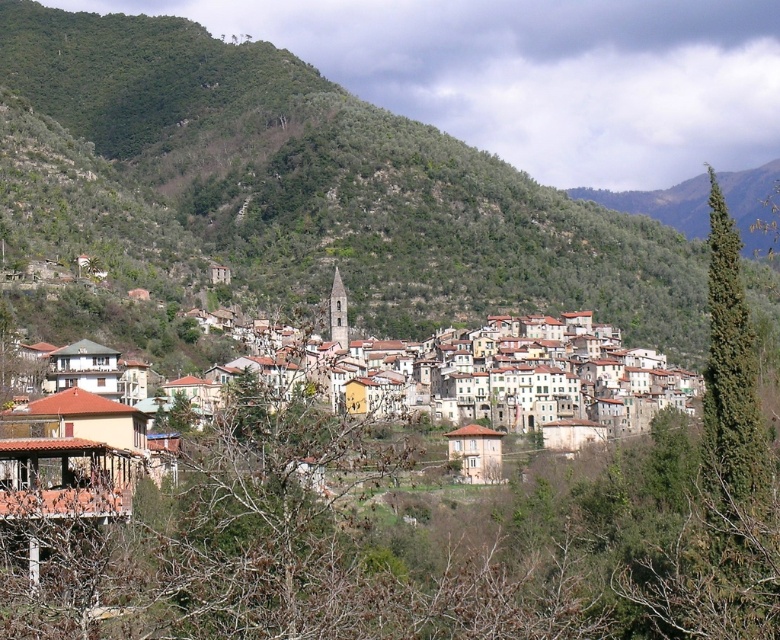
Question: Which point appears farthest from the camera in this image?

Choices:
 (A) (332, 157)
 (B) (743, 412)

Answer: (A)

Question: Is green leafy hillside at center smaller than green coniferous tree at right?

Choices:
 (A) yes
 (B) no

Answer: (B)

Question: Which point is closer to the camera taking this photo?

Choices:
 (A) (342, 218)
 (B) (760, 522)

Answer: (B)

Question: Is green leafy hillside at center positioned at the back of green coniferous tree at right?

Choices:
 (A) no
 (B) yes

Answer: (B)

Question: Which of the following is the farthest from the observer?

Choices:
 (A) green leafy hillside at center
 (B) green coniferous tree at right

Answer: (A)

Question: Can you confirm if green leafy hillside at center is bigger than green coniferous tree at right?

Choices:
 (A) yes
 (B) no

Answer: (A)